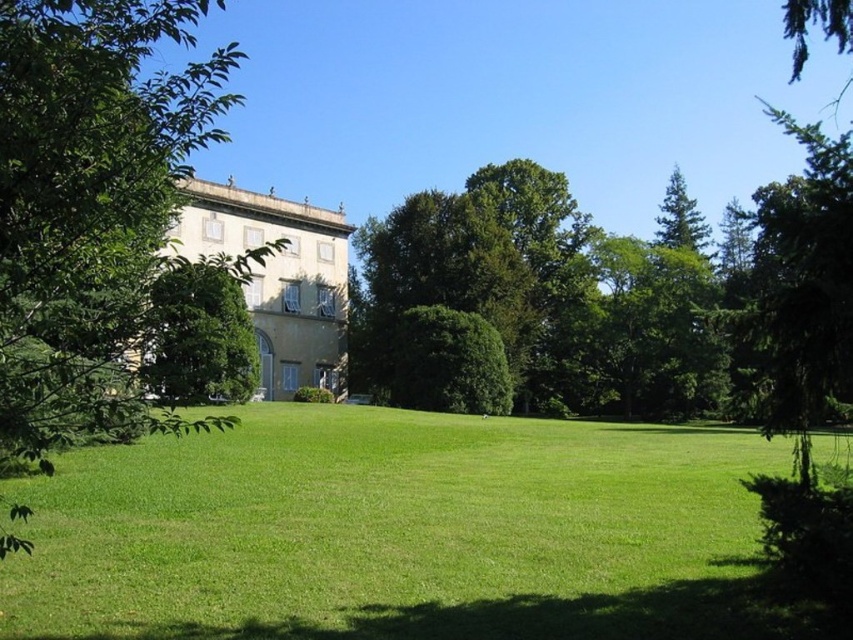
Can you confirm if green grass at center is positioned to the right of green leafy tree at left?

Indeed, green grass at center is positioned on the right side of green leafy tree at left.

Can you confirm if green grass at center is smaller than green leafy tree at left?

Indeed, green grass at center has a smaller size compared to green leafy tree at left.

Is point (161, 474) more distant than point (94, 188)?

That is True.

Find the location of a particular element. The width and height of the screenshot is (853, 640). green grass at center is located at coordinates (402, 532).

In order to click on green grass at center in this screenshot , I will do `click(402, 532)`.

Is green grass at center smaller than green leafy tree at right?

Correct, green grass at center occupies less space than green leafy tree at right.

Which is in front, point (717, 477) or point (824, 173)?

Point (824, 173) is more forward.

Locate an element on the screen. green grass at center is located at coordinates (402, 532).

Which is more to the left, green leafy tree at left or green leafy tree at right?

green leafy tree at left is more to the left.

Does point (114, 29) come behind point (805, 428)?

No, (114, 29) is in front of (805, 428).

The height and width of the screenshot is (640, 853). What do you see at coordinates (107, 228) in the screenshot?
I see `green leafy tree at left` at bounding box center [107, 228].

Where is `green leafy tree at left`? The image size is (853, 640). green leafy tree at left is located at coordinates (107, 228).